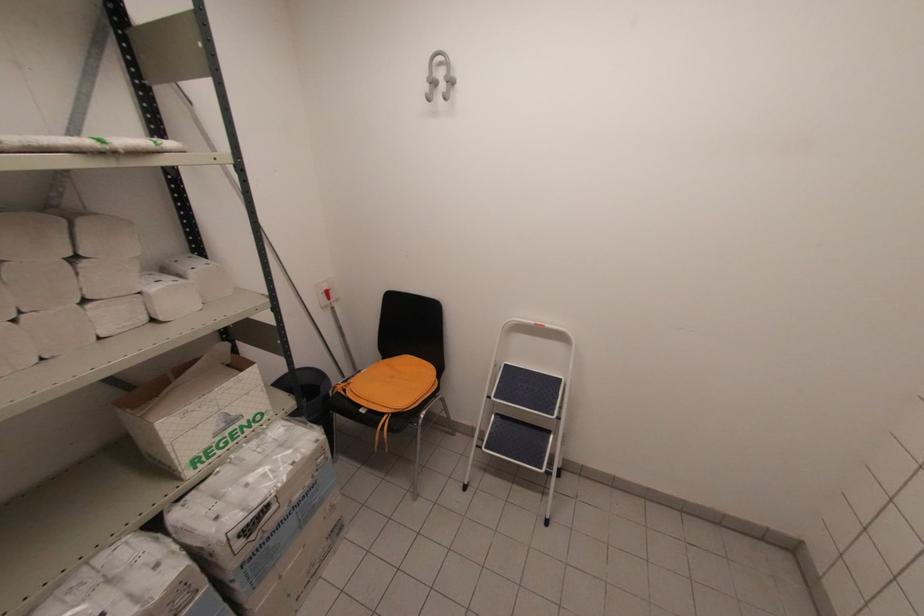
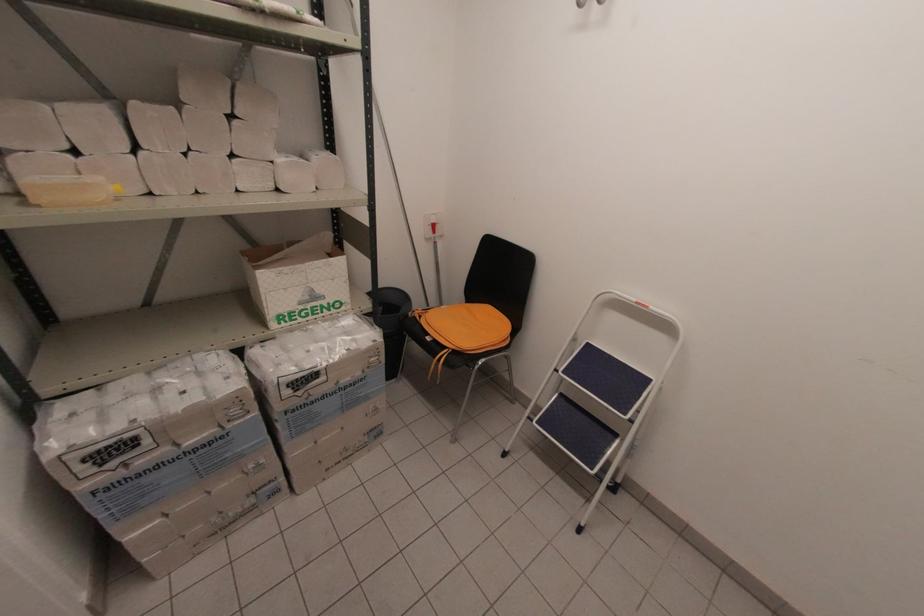
The point at [506,366] is marked in the first image. Where is the corresponding point in the second image?

(589, 344)